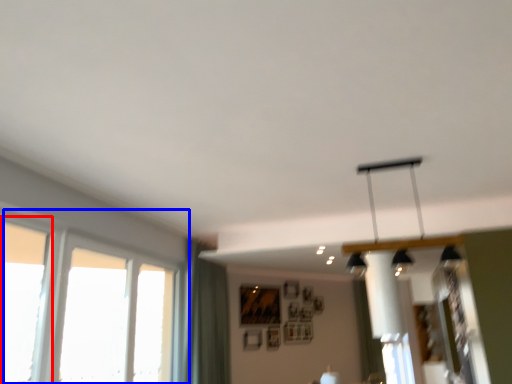
Question: Which of the following is the closest to the observer, window (highlighted by a red box) or window (highlighted by a blue box)?

Choices:
 (A) window
 (B) window

Answer: (A)